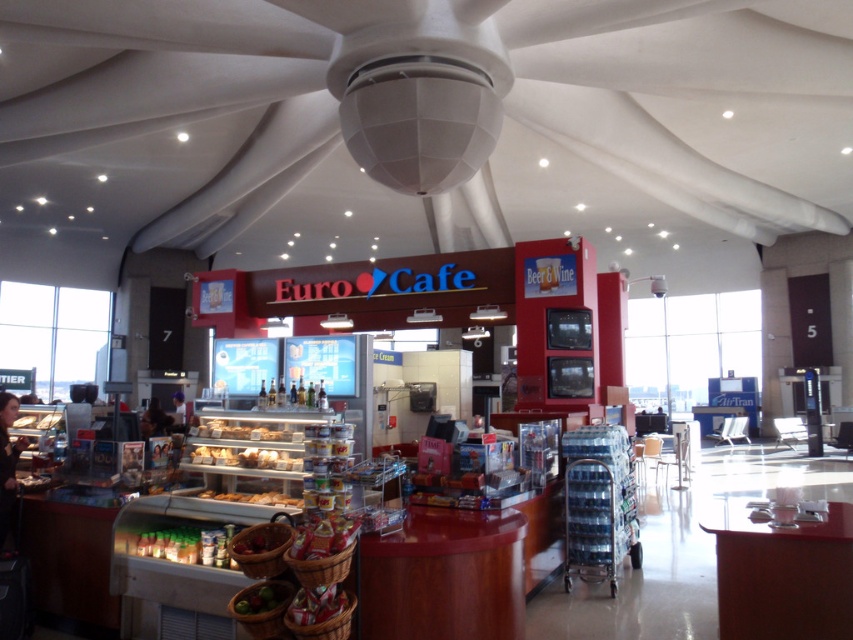
Question: Which of the following is the closest to the observer?

Choices:
 (A) shiny red apples at center
 (B) shiny red basket at center

Answer: (B)

Question: Is shiny red basket at center below shiny red apples at center?

Choices:
 (A) yes
 (B) no

Answer: (A)

Question: Is shiny red basket at center closer to camera compared to shiny red apples at center?

Choices:
 (A) no
 (B) yes

Answer: (B)

Question: Does shiny red basket at center appear under shiny red apples at center?

Choices:
 (A) yes
 (B) no

Answer: (A)

Question: Which point appears farthest from the camera in this image?

Choices:
 (A) (274, 540)
 (B) (306, 596)

Answer: (A)

Question: Among these objects, which one is farthest from the camera?

Choices:
 (A) shiny red apples at center
 (B) shiny red basket at center

Answer: (A)